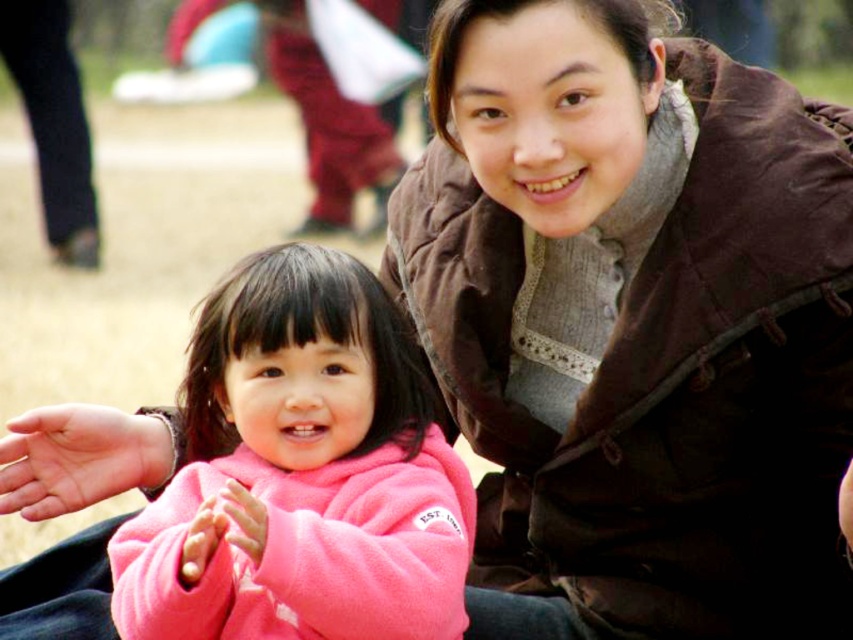
You are a photographer who wants to ensure both jackets are visible in the photo. Since the brown velvety jacket at center and the pink fleece jacket at center are in the same area, which one is positioned higher and might block the view of the other?

The brown velvety jacket at center is above the pink fleece jacket at center, so it might block the view of the pink fleece jacket at center if not adjusted.

You are a photographer who wants to ensure that both the brown velvety jacket at center and the smooth brown leather hand at center are clearly visible in the photo. Given that the camera can only focus on one object at a time, which object should you focus on to ensure the other remains in the background?

The camera should focus on the brown velvety jacket at center because it is wider than the smooth brown leather hand at center, allowing the hand to stay in the background while maintaining clarity on the primary subject.

Based on the scene description, where is the brown velvety jacket at center located in the image?

The brown velvety jacket at center is located at point 2D coordinates of [634,323].